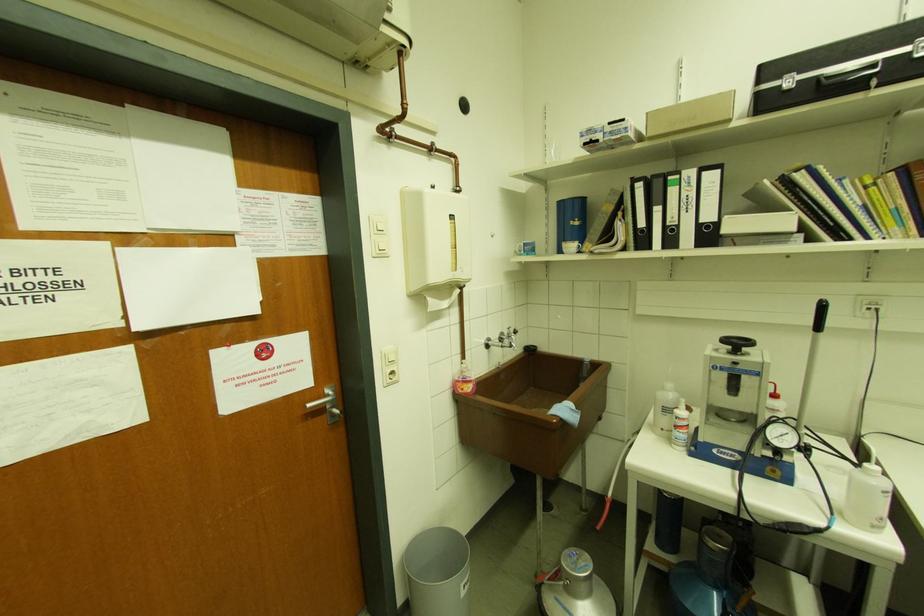
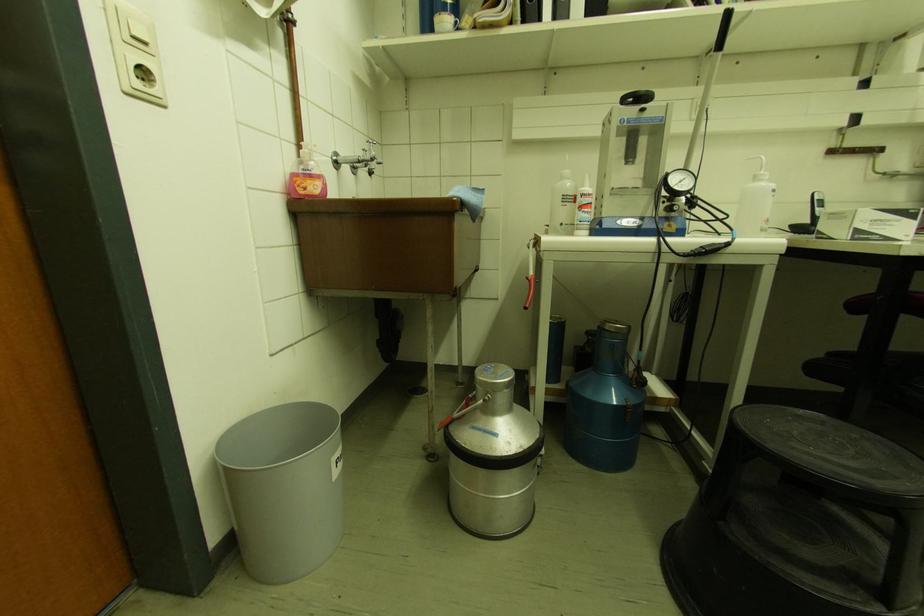
The point at (543, 569) is marked in the first image. Where is the corresponding point in the second image?

(436, 429)